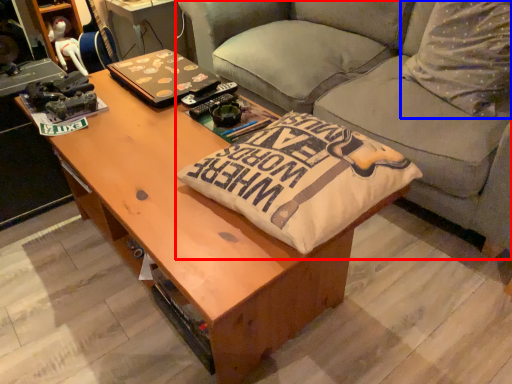
Question: Among these objects, which one is nearest to the camera, studio couch (highlighted by a red box) or throw pillow (highlighted by a blue box)?

Choices:
 (A) studio couch
 (B) throw pillow

Answer: (A)